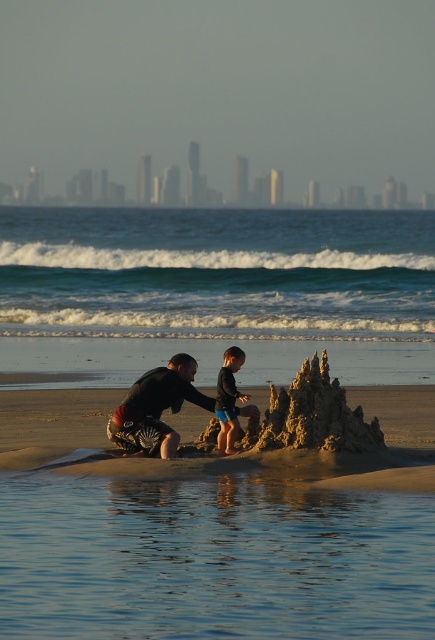
You are a photographer trying to capture the sandcastle scene. The brown sandy beach at center and the black matte shorts at center are both in your viewfinder. Which object should you focus on to ensure the larger subject is in sharp focus?

The brown sandy beach at center is bigger than the black matte shorts at center, so you should focus on the brown sandy beach at center to ensure the larger subject is in sharp focus.

You are a lifeguard on duty at the beach. You notice a golden sandcastle at center and a black matte shorts at center. A swimmer is approaching the shore and wants to know if they can safely walk between the sandcastle and the shorts without getting too close. The swimmer requires a minimum of 30 inches of space to pass comfortably. Can they do so?

The golden sandcastle at center and black matte shorts at center are 29.98 inches apart from each other. Since the swimmer requires a minimum of 30 inches of space to pass comfortably, they cannot safely walk between them without getting too close.